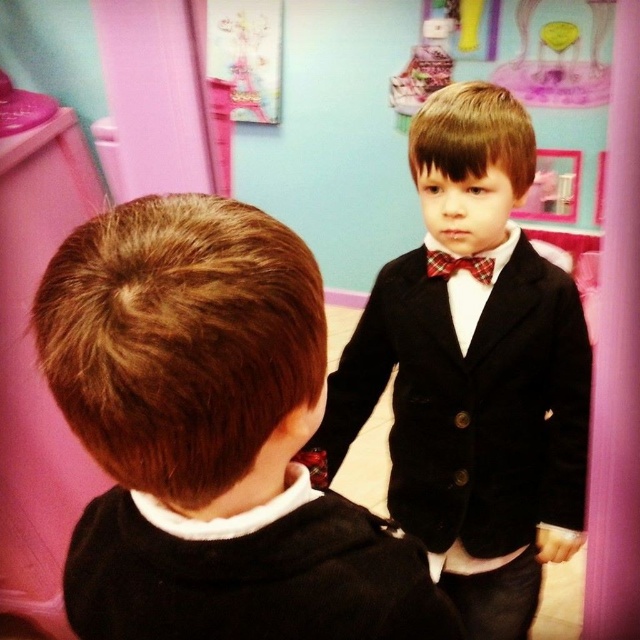
Question: Is velvet black suit at center positioned in front of plaid fabric bow tie at center?

Choices:
 (A) no
 (B) yes

Answer: (B)

Question: Which point appears farthest from the camera in this image?

Choices:
 (A) (573, 444)
 (B) (492, 264)

Answer: (A)

Question: Considering the real-world distances, which object is farthest from the plaid fabric bow tie at center?

Choices:
 (A) velvet black suit at center
 (B) black velvet suit at center

Answer: (B)

Question: Is velvet black suit at center positioned at the back of plaid fabric bow tie at center?

Choices:
 (A) yes
 (B) no

Answer: (B)

Question: Based on their relative distances, which object is farther from the plaid fabric bow tie at center?

Choices:
 (A) velvet black suit at center
 (B) black velvet suit at center

Answer: (B)

Question: Can you confirm if black velvet suit at center is positioned below plaid fabric bow tie at center?

Choices:
 (A) yes
 (B) no

Answer: (A)